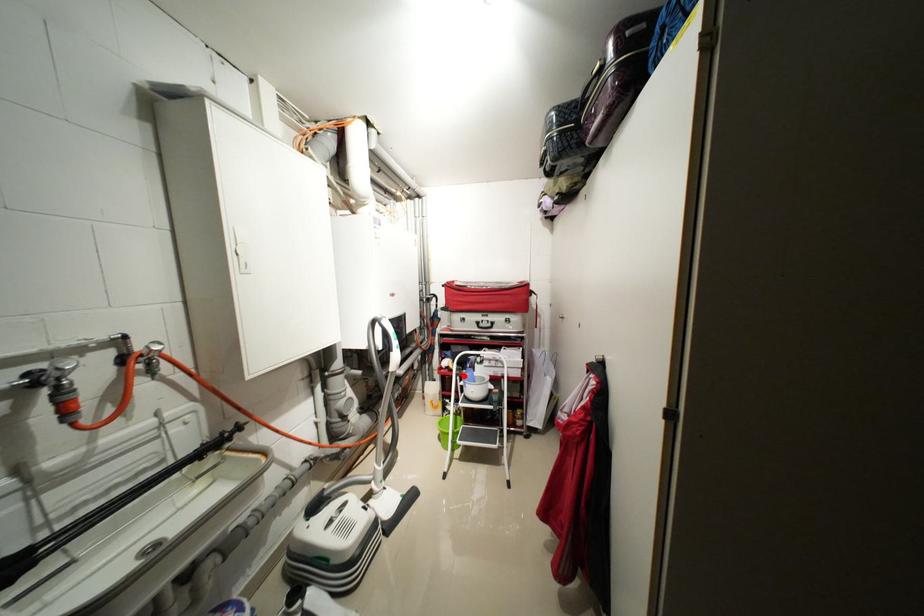
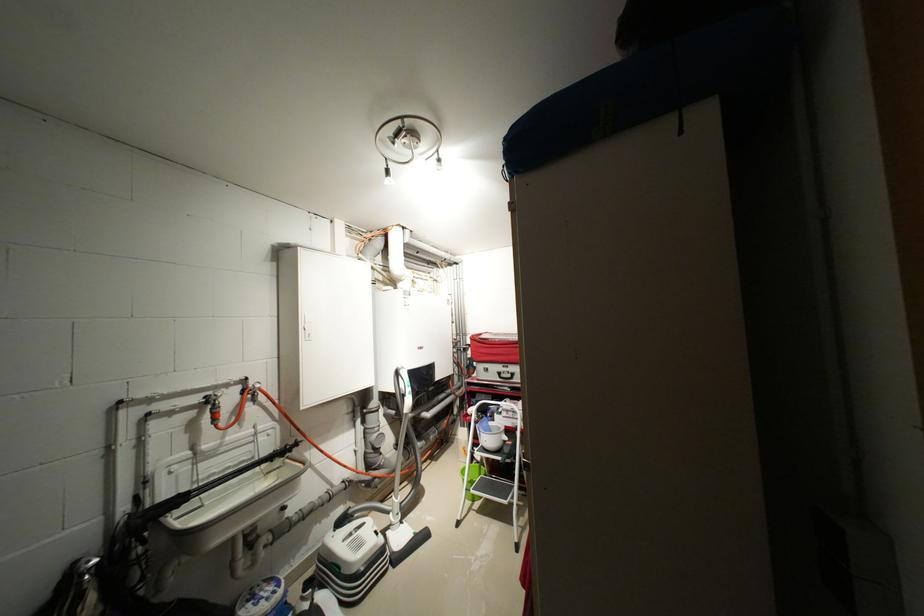
In the second image, find the point that corresponds to the highlighted location in the first image.

(482, 424)